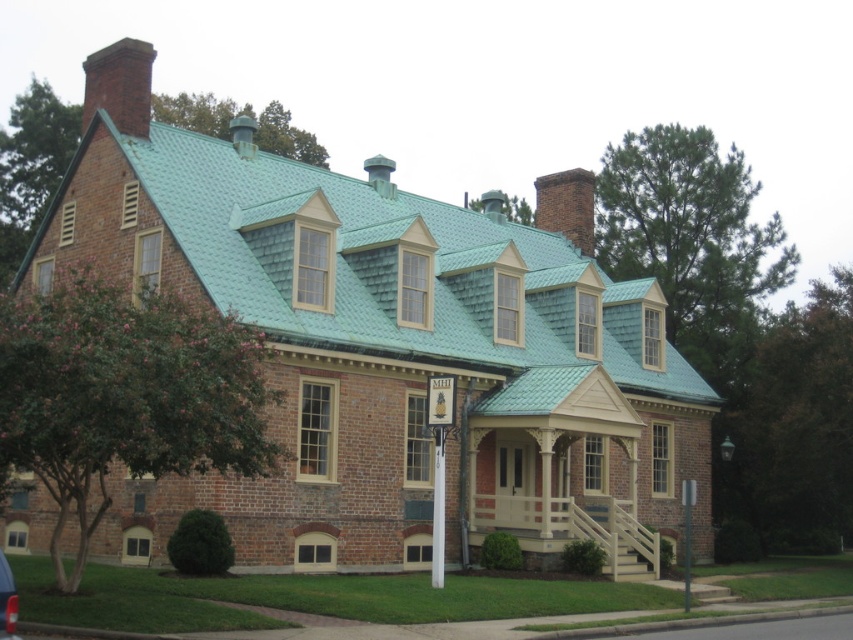
You are a delivery person trying to deliver a package to the historic brick house. The delivery requires you to park your vehicle between the white plastic pole at center and the metallic silver pole at lower right. Given that your vehicle is 15 feet long, will there be enough space between these two poles to park?

The distance between the white plastic pole at center and the metallic silver pole at lower right is 43.78 feet. Since the vehicle is only 15 feet long, there is sufficient space to park between them.

You are standing in front of the historic brick house and want to reach the entrance. Which object, the beige painted wood porch at center or the white plastic pole at center, is closer to the entrance?

The beige painted wood porch at center is closer to the entrance because it is located below the white plastic pole at center, meaning the porch is positioned directly in front of the entrance while the pole is above it.